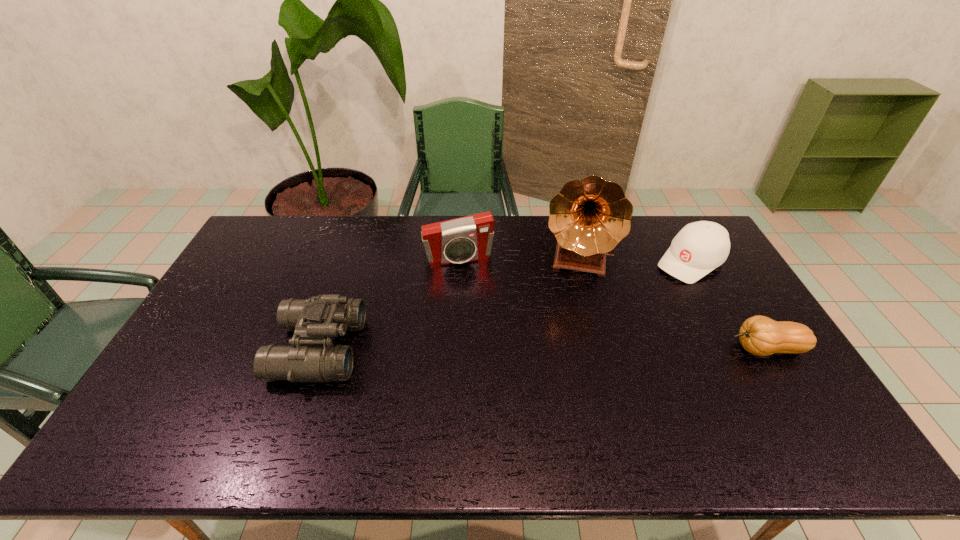
You are a GUI agent. You are given a task and a screenshot of the screen. Output one action in this format:
    pyautogui.click(x=<x>, y=<y>)
    Task: Click on the leftmost object
    
    Given the screenshot: What is the action you would take?
    pyautogui.click(x=312, y=357)

This screenshot has width=960, height=540. Find the location of `the shortest object`. the shortest object is located at coordinates (759, 335).

This screenshot has width=960, height=540. I want to click on the tallest object, so click(x=589, y=217).

Where is `phonograph_record`? The height and width of the screenshot is (540, 960). phonograph_record is located at coordinates (589, 217).

This screenshot has height=540, width=960. Identify the location of the fourth tallest object. (700, 247).

At what (x,y) coordinates should I click in order to perform the action: click on the second object from left to right. Please return your answer as a coordinate pair (x, y). Looking at the image, I should click on (469, 238).

In order to click on vacant region located through the lenses of the leftmost object in this screenshot , I will do `click(434, 349)`.

Where is `vacant space located on the stem side of the shortest object`? The image size is (960, 540). vacant space located on the stem side of the shortest object is located at coordinates (588, 349).

Locate an element on the screen. vacant region located on the stem side of the shortest object is located at coordinates [699, 349].

Where is `free space located 0.390m on the stem side of the shortest object`? free space located 0.390m on the stem side of the shortest object is located at coordinates (588, 349).